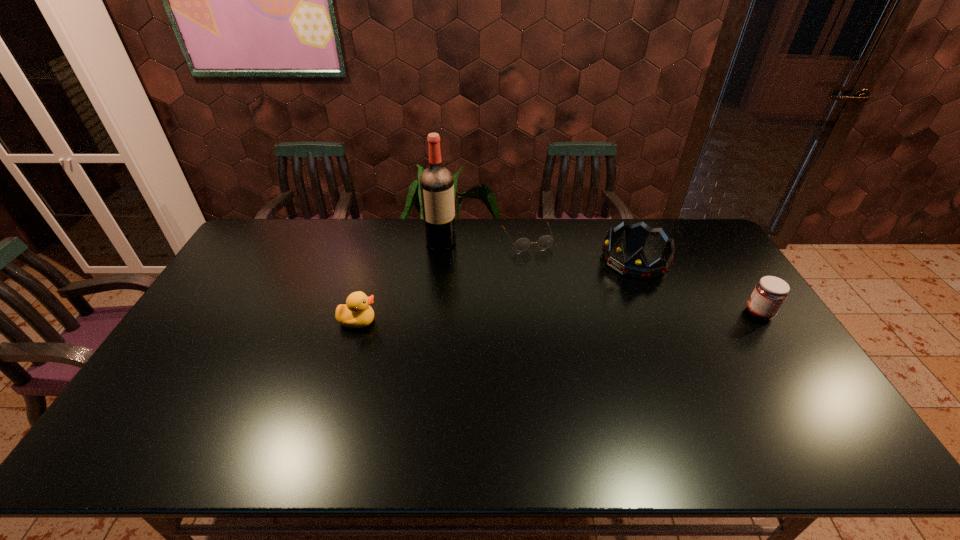
The height and width of the screenshot is (540, 960). What are the coordinates of `vacant spot on the desktop that is between the leftmost object and the jam and is positioned at the front of the second object from right to left with jewels` in the screenshot? It's located at (531, 318).

Find the location of a particular element. free space on the desktop that is between the leftmost object and the jam and is positioned on the temples of the shortest object is located at coordinates (562, 317).

Locate an element on the screen. The width and height of the screenshot is (960, 540). vacant space on the desktop that is between the leftmost object and the jam and is positioned on the front-facing side of the tallest object is located at coordinates (502, 318).